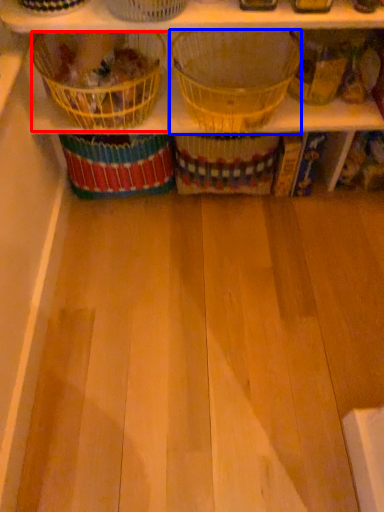
Question: Which object is closer to the camera taking this photo, basket (highlighted by a red box) or basket (highlighted by a blue box)?

Choices:
 (A) basket
 (B) basket

Answer: (B)